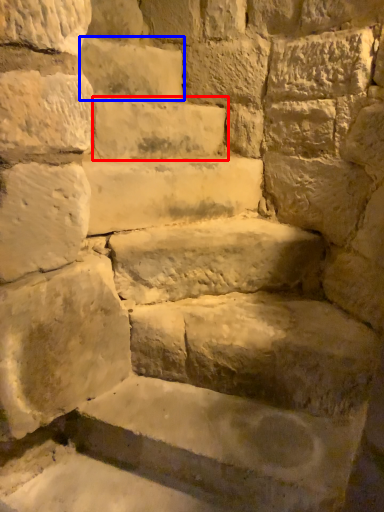
Question: Among these objects, which one is farthest to the camera, brick (highlighted by a red box) or brick (highlighted by a blue box)?

Choices:
 (A) brick
 (B) brick

Answer: (B)